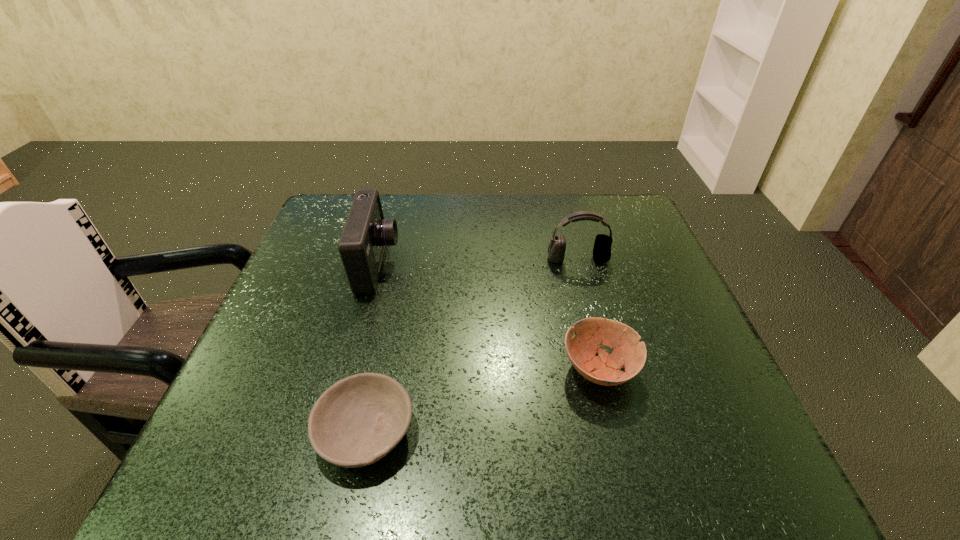
The width and height of the screenshot is (960, 540). I want to click on empty space between the headset and the shortest object, so click(x=471, y=345).

Locate an element on the screen. Image resolution: width=960 pixels, height=540 pixels. object that is the closest to the shorter bowl is located at coordinates (365, 234).

Identify which object is the third closest to the shorter bowl. Please provide its 2D coordinates. Your answer should be formatted as a tuple, i.e. [(x, y)], where the tuple contains the x and y coordinates of a point satisfying the conditions above.

[(602, 246)]

Find the location of a particular element. The width and height of the screenshot is (960, 540). free space that satisfies the following two spatial constraints: 1. on the headband of the headset; 2. on the front-facing side of the camera is located at coordinates (580, 266).

I want to click on free space that satisfies the following two spatial constraints: 1. on the front-facing side of the camera; 2. on the back side of the shorter bowl, so click(332, 431).

Image resolution: width=960 pixels, height=540 pixels. I want to click on vacant area in the image that satisfies the following two spatial constraints: 1. on the front-facing side of the camera; 2. on the back side of the shortest object, so click(332, 431).